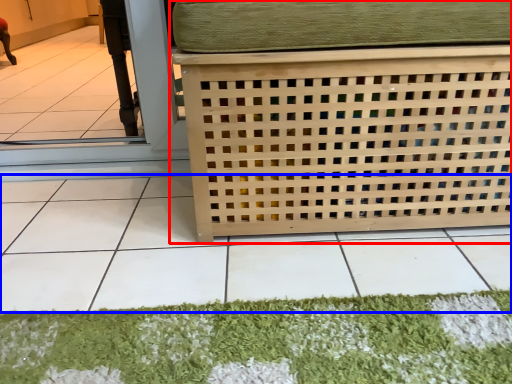
Question: Which of the following is the closest to the observer, furniture (highlighted by a red box) or tile (highlighted by a blue box)?

Choices:
 (A) furniture
 (B) tile

Answer: (B)